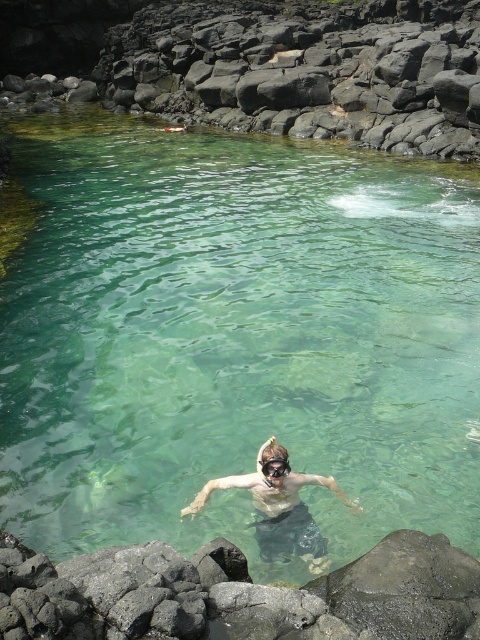
You are a safety officer assessing the snorkeling area. You notice the black rock at upper center and the smooth skin diver at center. Which object is closer to the surface of the water?

The black rock at upper center is closer to the surface of the water because it is further to the viewer than the smooth skin diver at center.

You are standing at point A and want to reach point B while avoiding the rocky terrain. The coordinates of point A are (217, 106) and point B are 0.333, 0.888. Given the distance between them is 116.81 feet, can you estimate how far you need to walk to reach point B from point A?

The distance between point A and point B is 116.81 feet, so you need to walk approximately 116.81 feet to reach point B from point A.

You are a safety officer monitoring the snorkeling area. The safety zone is defined as the area within coordinates between 0.6 and 0.8 on the x and y axes. Is the smooth skin diver at center within the safety zone?

The smooth skin diver at center is located at point (278, 509). Since both coordinates fall within the 0.6 to 0.8 range, the diver is within the safety zone.